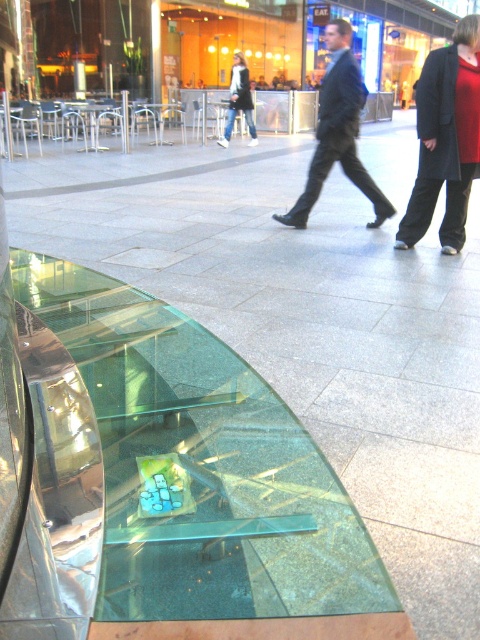
You are standing in the shopping district and see the transparent glass table at lower left and the dark blue suit at center. Which object is located more to the left?

The transparent glass table at lower left is positioned on the left side of dark blue suit at center, so it is more to the left.

You are standing at the point marked by the coordinates point [337,131] in the image. What object is directly in front of you?

The point [337,131] indicates dark blue suit at center, so the dark blue suit at center is directly in front of you.